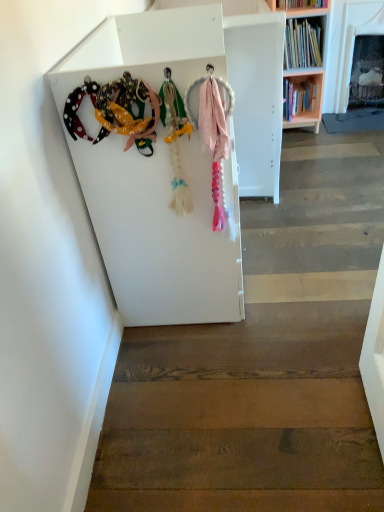
Identify the location of wooden floor at center. The width and height of the screenshot is (384, 512). (263, 361).

In order to face wooden floor at center, should I rotate leftwards or rightwards?

To align with it, rotate right about 16.000°.

What do you see at coordinates (263, 361) in the screenshot? I see `wooden floor at center` at bounding box center [263, 361].

Locate an element on the screen. Image resolution: width=384 pixels, height=512 pixels. wooden floor at center is located at coordinates (263, 361).